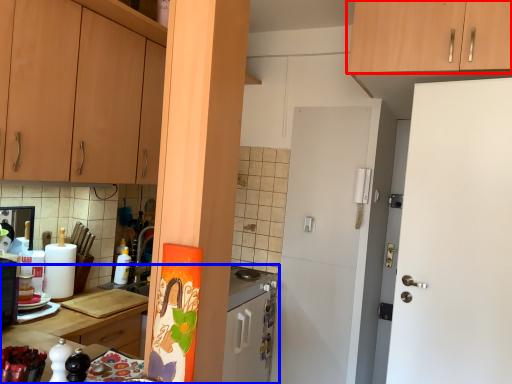
Question: Among these objects, which one is nearest to the camera, cabinetry (highlighted by a red box) or countertop (highlighted by a blue box)?

Choices:
 (A) cabinetry
 (B) countertop

Answer: (B)